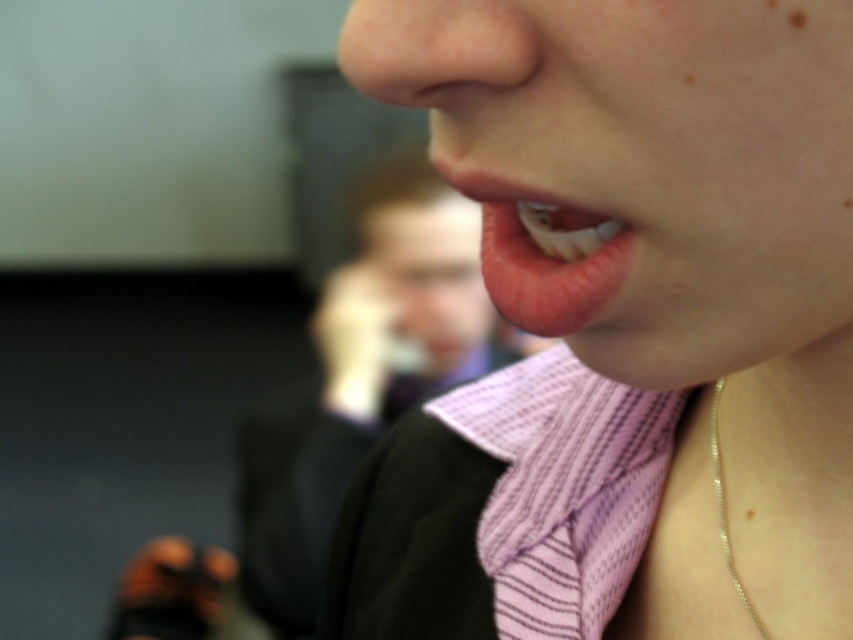
Who is positioned more to the right, pink striped shirt at center or brown matte freckle at upper right?

brown matte freckle at upper right is more to the right.

Who is shorter, pink striped shirt at center or brown matte freckle at upper right?

brown matte freckle at upper right

Does point (405, 364) come closer to viewer compared to point (798, 17)?

No, (405, 364) is further to viewer.

The height and width of the screenshot is (640, 853). Find the location of `pink striped shirt at center`. pink striped shirt at center is located at coordinates (363, 376).

Is pink glossy lips at center in front of brown matte freckle at upper right?

No, pink glossy lips at center is further to the viewer.

Between point (505, 275) and point (793, 22), which one is positioned in front?

Point (793, 22)

Identify the location of pink glossy lips at center. This screenshot has height=640, width=853. (537, 262).

Between gold chain at lower right and brown matte freckle at upper right, which one appears on the left side from the viewer's perspective?

brown matte freckle at upper right

Between gold chain at lower right and brown matte freckle at upper right, which one has less height?

brown matte freckle at upper right

Is point (718, 387) positioned after point (799, 20)?

Yes, point (718, 387) is behind point (799, 20).

You are a GUI agent. You are given a task and a screenshot of the screen. Output one action in this format:
    pyautogui.click(x=<x>, y=<y>)
    Task: Click on the gold chain at lower right
    This screenshot has width=853, height=640.
    Given the screenshot: What is the action you would take?
    pyautogui.click(x=726, y=513)